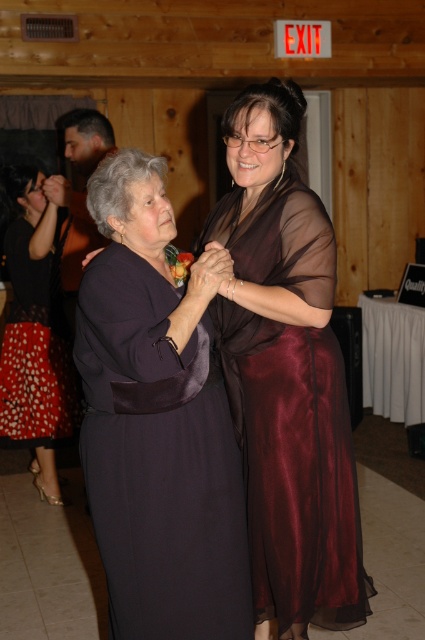
You are a photographer at a social event. You need to capture a photo of the dark satin dress at center and the red dotted fabric dress at lower left. Which dress will appear smaller in the photo?

The dark satin dress at center occupies less space than the red dotted fabric dress at lower left, so it will appear smaller in the photo.

You are a photographer at the event and need to position yourself so both the dark satin dress at center and the red dotted fabric dress at lower left are fully visible in the frame. Considering their heights, which dress should you focus on to ensure both are in focus?

The dark satin dress at center has a lesser height compared to the red dotted fabric dress at lower left. To ensure both are in focus, you should focus on the red dotted fabric dress at lower left since it is taller, allowing the shorter dress to remain within the depth of field.